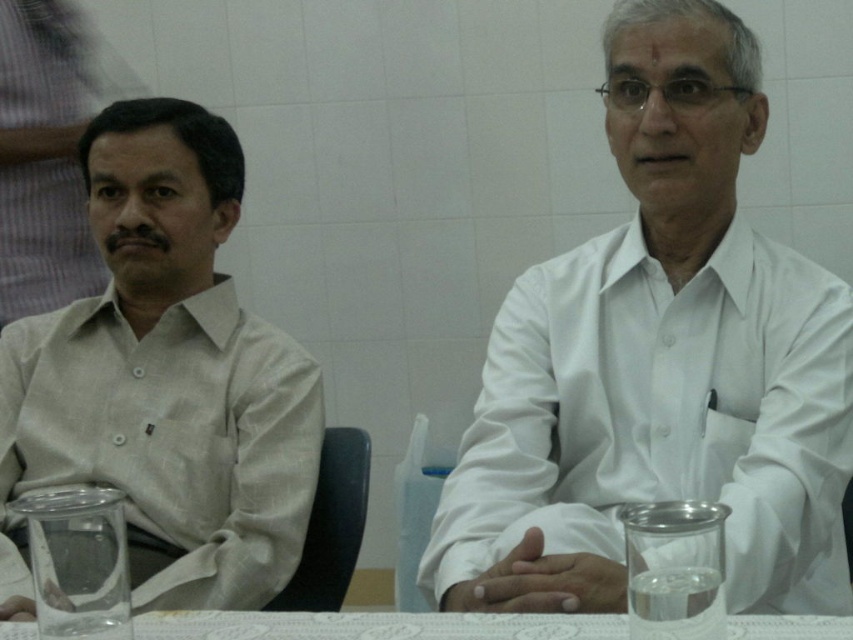
Which is behind, point (99, 440) or point (837, 628)?

Positioned behind is point (99, 440).

Does light beige fabric shirt at left have a larger size compared to white lace tablecloth at center?

Yes, light beige fabric shirt at left is bigger than white lace tablecloth at center.

This screenshot has height=640, width=853. Identify the location of light beige fabric shirt at left. (167, 376).

At what (x,y) coordinates should I click in order to perform the action: click on white matte shirt at center. Please return your answer as a coordinate pair (x, y). This screenshot has width=853, height=640. Looking at the image, I should click on (659, 362).

Is white matte shirt at center to the left of white lace tablecloth at center from the viewer's perspective?

Incorrect, white matte shirt at center is not on the left side of white lace tablecloth at center.

I want to click on white matte shirt at center, so click(659, 362).

Is white matte shirt at center taller than light beige fabric shirt at left?

Correct, white matte shirt at center is much taller as light beige fabric shirt at left.

Who is shorter, white matte shirt at center or light beige fabric shirt at left?

light beige fabric shirt at left is shorter.

Is point (724, 140) closer to viewer compared to point (99, 131)?

Yes, point (724, 140) is in front of point (99, 131).

In order to click on white matte shirt at center in this screenshot , I will do `click(659, 362)`.